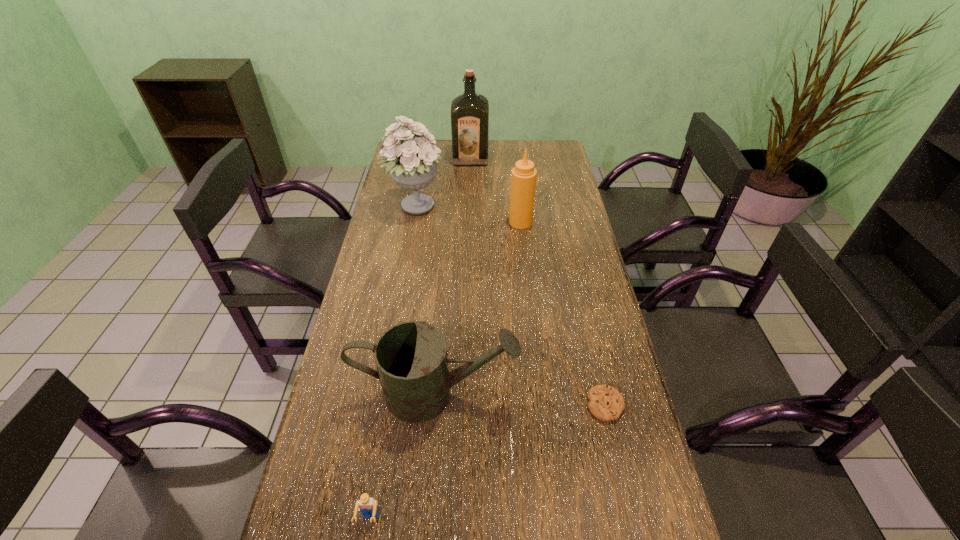
Where is `blank area in the image that satisfies the following two spatial constraints: 1. on the label of the liquor; 2. on the left side of the rightmost object`? The height and width of the screenshot is (540, 960). blank area in the image that satisfies the following two spatial constraints: 1. on the label of the liquor; 2. on the left side of the rightmost object is located at coordinates (464, 405).

This screenshot has height=540, width=960. Find the location of `vacant position in the image that satisfies the following two spatial constraints: 1. with the spout on the watering can; 2. on the right side of the rightmost object`. vacant position in the image that satisfies the following two spatial constraints: 1. with the spout on the watering can; 2. on the right side of the rightmost object is located at coordinates (435, 405).

You are a GUI agent. You are given a task and a screenshot of the screen. Output one action in this format:
    pyautogui.click(x=<x>, y=<y>)
    Task: Click on the free spot that satisfies the following two spatial constraints: 1. with the spout on the watering can; 2. on the face of the Lego
    
    Given the screenshot: What is the action you would take?
    pyautogui.click(x=425, y=520)

Where is `free region that satisfies the following two spatial constraints: 1. on the label of the third tallest object; 2. on the left side of the farthest object`? Image resolution: width=960 pixels, height=540 pixels. free region that satisfies the following two spatial constraints: 1. on the label of the third tallest object; 2. on the left side of the farthest object is located at coordinates (468, 222).